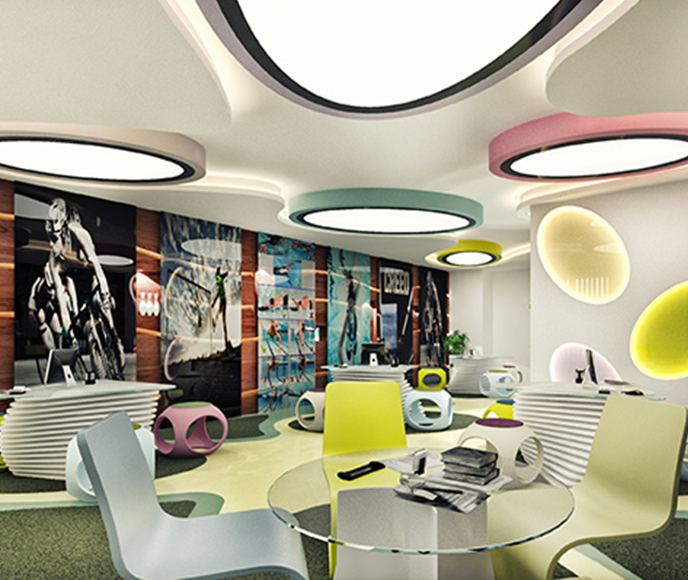
Locate an element on the screen. Image resolution: width=688 pixels, height=580 pixels. desk is located at coordinates (65, 415), (559, 409), (475, 369), (378, 369).